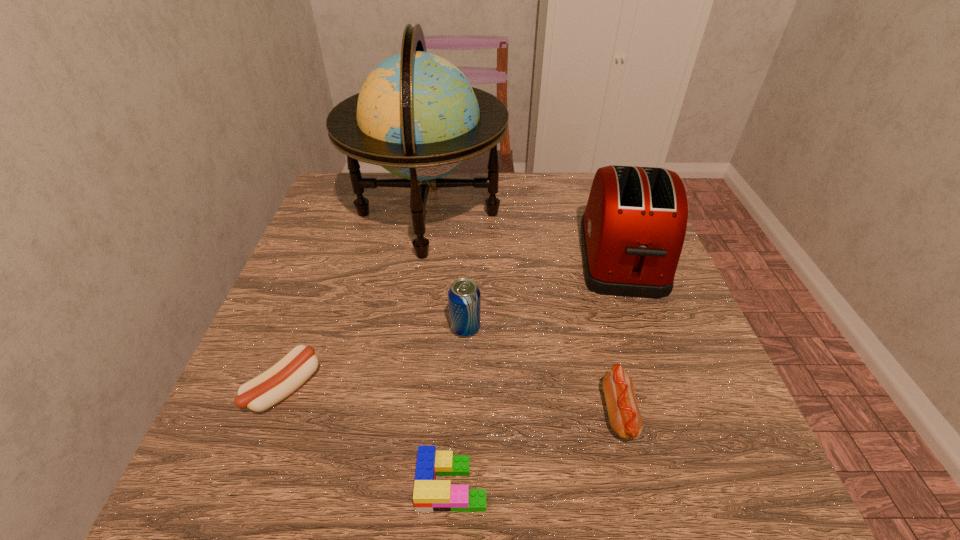
Locate an element on the screen. The image size is (960, 540). vacant space that satisfies the following two spatial constraints: 1. on the back side of the Lego; 2. on the surface of the tallest object is located at coordinates (465, 214).

The image size is (960, 540). Identify the location of vacant space that satisfies the following two spatial constraints: 1. on the surface of the tallest object; 2. on the left side of the second tallest object. (421, 259).

Where is `free location that satisfies the following two spatial constraints: 1. on the back side of the third tallest object; 2. on the left side of the toaster`? This screenshot has height=540, width=960. free location that satisfies the following two spatial constraints: 1. on the back side of the third tallest object; 2. on the left side of the toaster is located at coordinates (468, 259).

This screenshot has height=540, width=960. In order to click on free space that satisfies the following two spatial constraints: 1. on the back side of the fourth shortest object; 2. on the surface of the globe in this screenshot , I will do `click(469, 214)`.

You are a GUI agent. You are given a task and a screenshot of the screen. Output one action in this format:
    pyautogui.click(x=<x>, y=<y>)
    Task: Click on the vacant space that satisfies the following two spatial constraints: 1. on the back side of the nearest object; 2. on the right side of the right sausage
    
    Given the screenshot: What is the action you would take?
    pyautogui.click(x=455, y=413)

Locate an element on the screen. vacant space that satisfies the following two spatial constraints: 1. on the surface of the tallest object; 2. on the front side of the left sausage is located at coordinates (402, 388).